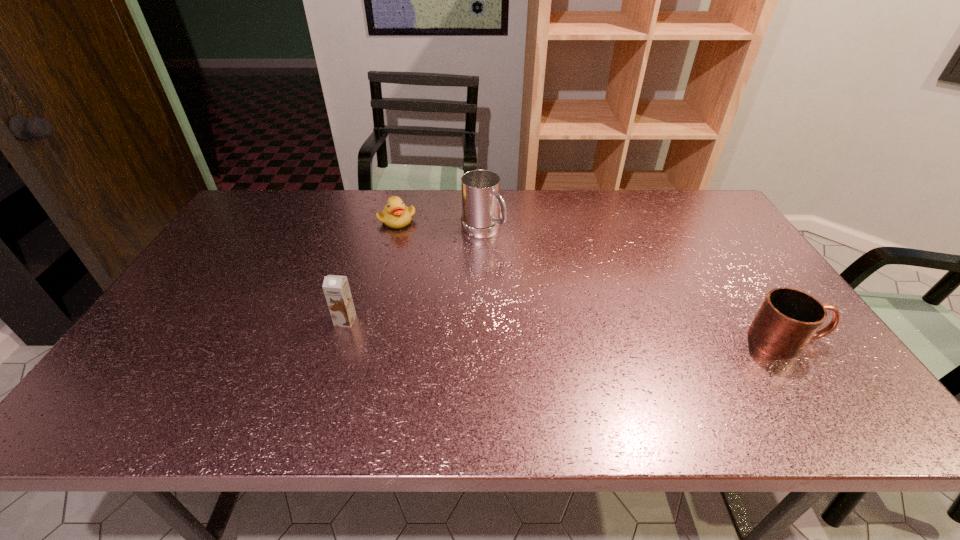
The width and height of the screenshot is (960, 540). I want to click on vacant region at the left edge, so click(x=223, y=274).

Locate an element on the screen. vacant position at the right edge of the desktop is located at coordinates (730, 236).

At what (x,y) coordinates should I click in order to perform the action: click on blank area at the far left corner. Please return your answer as a coordinate pair (x, y). The width and height of the screenshot is (960, 540). Looking at the image, I should click on (292, 199).

In the image, there is a desktop. Where is `free space at the near left corner`? This screenshot has height=540, width=960. free space at the near left corner is located at coordinates 191,369.

Where is `free space at the far right corner of the desktop`? The width and height of the screenshot is (960, 540). free space at the far right corner of the desktop is located at coordinates coord(686,201).

You are a GUI agent. You are given a task and a screenshot of the screen. Output one action in this format:
    pyautogui.click(x=<x>, y=<y>)
    Task: Click on the free point between the rightmost object and the third shortest object
    Image resolution: width=960 pixels, height=540 pixels.
    Given the screenshot: What is the action you would take?
    pyautogui.click(x=566, y=330)

You are a GUI agent. You are given a task and a screenshot of the screen. Output one action in this format:
    pyautogui.click(x=<x>, y=<y>)
    Task: Click on the free spot between the shortest object and the second tallest object
    The height and width of the screenshot is (540, 960).
    Given the screenshot: What is the action you would take?
    pyautogui.click(x=372, y=270)

I want to click on empty space between the duckling and the left mug, so click(x=440, y=225).

Locate an element on the screen. The height and width of the screenshot is (540, 960). unoccupied position between the second object from right to left and the second tallest object is located at coordinates (414, 275).

Find the location of a particular element. This screenshot has height=540, width=960. vacant space that is in between the duckling and the second object from right to left is located at coordinates (440, 225).